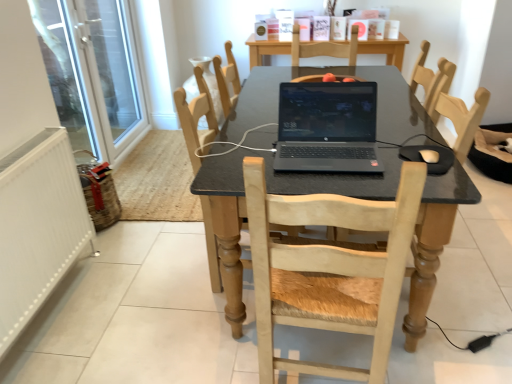
The height and width of the screenshot is (384, 512). I want to click on vacant area to the right of white textured radiator at left, so point(138,312).